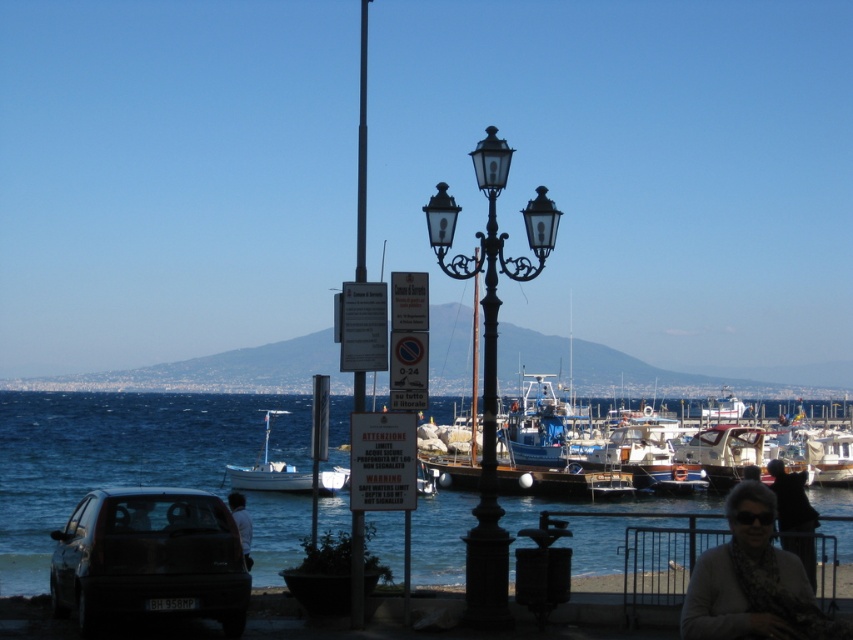
You are standing on the beach looking out to sea. You see the blue water at lower center and the white matte boat at center. Which object is closer to you?

The blue water at lower center is closer to you because it is in front of the white matte boat at center.

You are standing at the coastal view and want to take a photo of the white matte boat at center and dark gray fabric jacket at lower center. Which object should be placed on the left side to frame the photo properly?

The white matte boat at center should be placed on the left side because it is already positioned on the left side of the dark gray fabric jacket at lower center.

You are standing at the coastal view scene with a clear blue sky. You see a white matte boat at center and a dark gray fabric jacket at lower center. Which object is wider?

The white matte boat at center is wider than the dark gray fabric jacket at lower center according to the description.